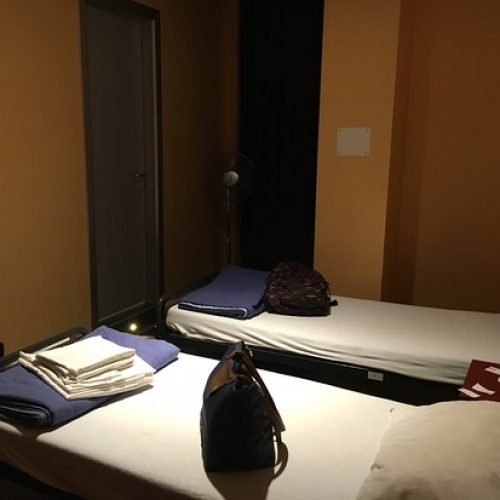
This screenshot has height=500, width=500. In order to click on room wall in this screenshot , I will do `click(47, 196)`, `click(185, 114)`, `click(366, 244)`, `click(447, 261)`.